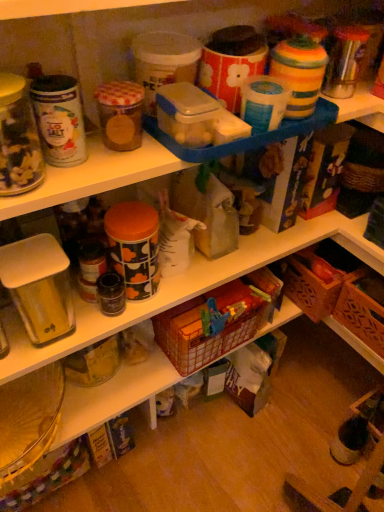
Question: From a real-world perspective, is plastic woven basket at center, marked as the first basket in a left-to-right arrangement, below brown woven basket at lower right, arranged as the 2th basket when viewed from the left?

Choices:
 (A) no
 (B) yes

Answer: (A)

Question: Can you confirm if plastic woven basket at center, marked as the first basket in a left-to-right arrangement, is bigger than brown woven basket at lower right, arranged as the 2th basket when viewed from the left?

Choices:
 (A) no
 (B) yes

Answer: (B)

Question: Is the depth of plastic woven basket at center, marked as the first basket in a left-to-right arrangement, greater than that of brown woven basket at lower right, arranged as the 2th basket when viewed from the left?

Choices:
 (A) no
 (B) yes

Answer: (A)

Question: Does plastic woven basket at center, marked as the first basket in a left-to-right arrangement, have a lesser height compared to brown woven basket at lower right, arranged as the 2th basket when viewed from the left?

Choices:
 (A) yes
 (B) no

Answer: (B)

Question: Is plastic woven basket at center, the second basket when ordered from right to left, not within brown woven basket at lower right, arranged as the 2th basket when viewed from the left?

Choices:
 (A) yes
 (B) no

Answer: (A)

Question: Is plastic woven basket at center, marked as the first basket in a left-to-right arrangement, turned away from brown woven basket at lower right, positioned as the 1th basket in right-to-left order?

Choices:
 (A) yes
 (B) no

Answer: (B)

Question: Is brown woven basket at lower right, arranged as the 2th basket when viewed from the left, surrounding plastic woven basket at center, the second basket when ordered from right to left?

Choices:
 (A) yes
 (B) no

Answer: (B)

Question: Is brown woven basket at lower right, arranged as the 2th basket when viewed from the left, to the right of plastic woven basket at center, marked as the first basket in a left-to-right arrangement, from the viewer's perspective?

Choices:
 (A) no
 (B) yes

Answer: (B)

Question: Is brown woven basket at lower right, positioned as the 1th basket in right-to-left order, aimed at plastic woven basket at center, the second basket when ordered from right to left?

Choices:
 (A) yes
 (B) no

Answer: (A)

Question: From the image's perspective, would you say brown woven basket at lower right, arranged as the 2th basket when viewed from the left, is shown under plastic woven basket at center, the second basket when ordered from right to left?

Choices:
 (A) yes
 (B) no

Answer: (B)

Question: Is brown woven basket at lower right, arranged as the 2th basket when viewed from the left, located outside plastic woven basket at center, the second basket when ordered from right to left?

Choices:
 (A) yes
 (B) no

Answer: (A)

Question: Are brown woven basket at lower right, positioned as the 1th basket in right-to-left order, and plastic woven basket at center, marked as the first basket in a left-to-right arrangement, making contact?

Choices:
 (A) yes
 (B) no

Answer: (B)

Question: From the image's perspective, is brown woven basket at lower right, positioned as the 1th basket in right-to-left order, positioned above or below plastic woven basket at center, the second basket when ordered from right to left?

Choices:
 (A) below
 (B) above

Answer: (B)